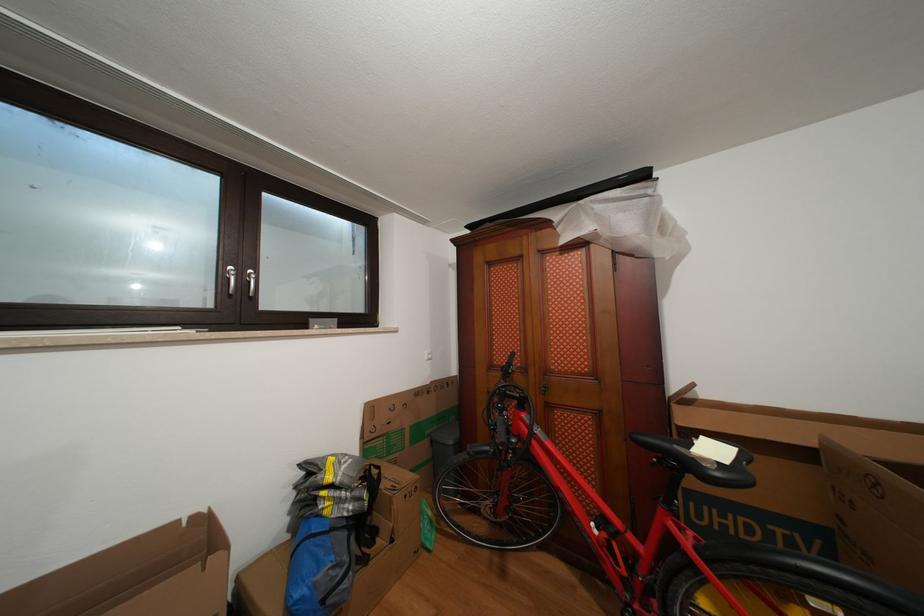
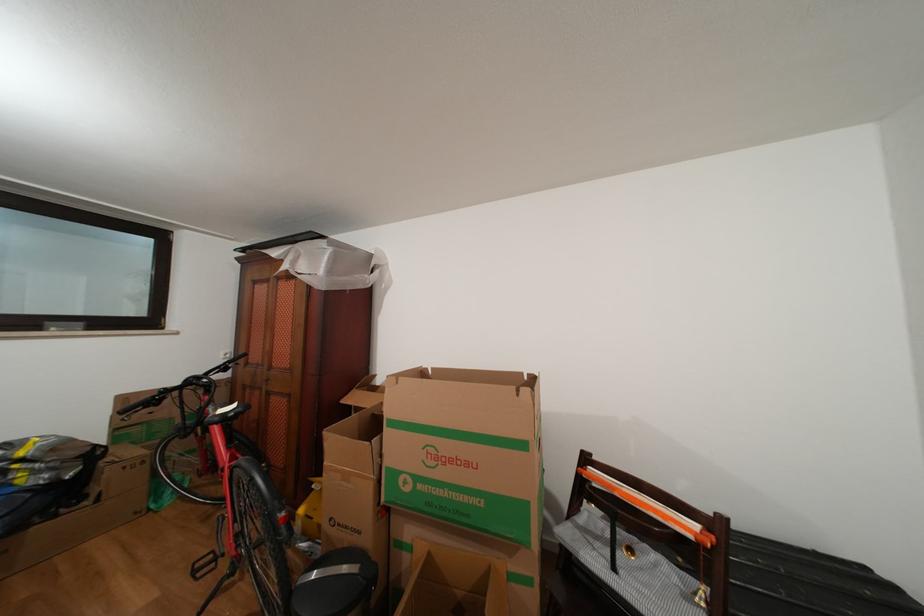
What movement of the cameraman would produce the second image?

The cameraman moved toward right, backward.